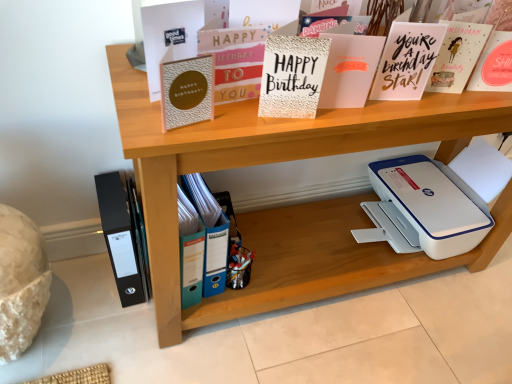
Question: Would you say metallic pen holder at center is inside or outside gold textured card at upper center, the 2th paperback book in the left-to-right sequence?

Choices:
 (A) inside
 (B) outside

Answer: (B)

Question: From a real-world perspective, relative to gold textured card at upper center, the 2th paperback book in the left-to-right sequence, is metallic pen holder at center vertically above or below?

Choices:
 (A) above
 (B) below

Answer: (B)

Question: Which is nearer to the matte gold card at upper center, arranged as the fifth paperback book when viewed from the right?

Choices:
 (A) black matte folder at lower left
 (B) wooden shelf at upper center
 (C) white plastic printer at lower right
 (D) blue plastic file at lower center
 (E) textured gold card at center, which ranks as the fourth paperback book in left-to-right order

Answer: (E)

Question: Which of these objects is positioned closest to the metallic pen holder at center?

Choices:
 (A) textured gold card at center, which appears as the 4th paperback book when viewed from the right
 (B) wooden shelf at upper center
 (C) blue plastic file at lower center
 (D) black matte folder at lower left
 (E) matte gold card at upper center, which is counted as the third paperback book, starting from the left

Answer: (C)